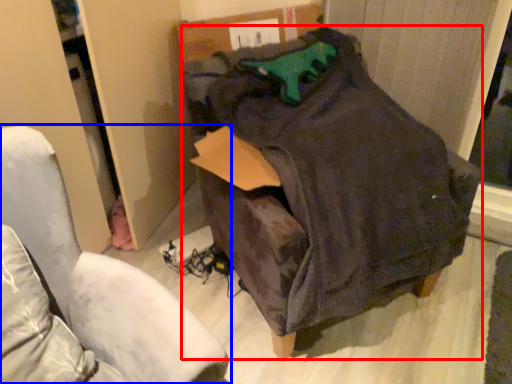
Question: Which object is further to the camera taking this photo, bean bag chair (highlighted by a red box) or furniture (highlighted by a blue box)?

Choices:
 (A) bean bag chair
 (B) furniture

Answer: (A)